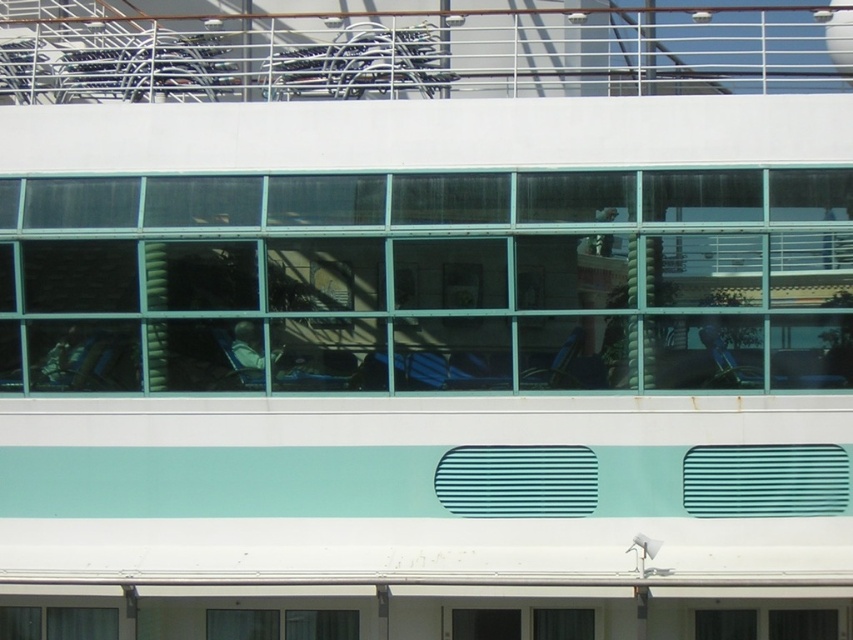
You are a maintenance worker on a cruise ship. You need to replace a glass panel. You have two options available in your inventory. The first is a thinner panel, and the second is a thicker one. Looking at the transparent glass windows at center and the clear glass window at lower center, which existing window would the thinner panel fit into?

The transparent glass windows at center is thinner than the clear glass window at lower center, so the thinner panel would fit into the transparent glass windows at center.

What are the coordinates of the transparent glass windows at center?

The transparent glass windows at center are located at coordinates point (434, 282).